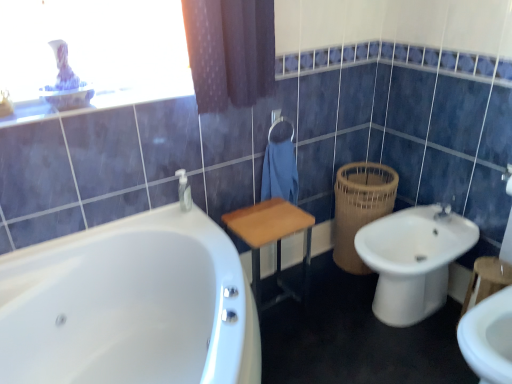
The width and height of the screenshot is (512, 384). I want to click on vacant space positioned to the left of translucent plastic soap dispenser at center, so click(x=156, y=214).